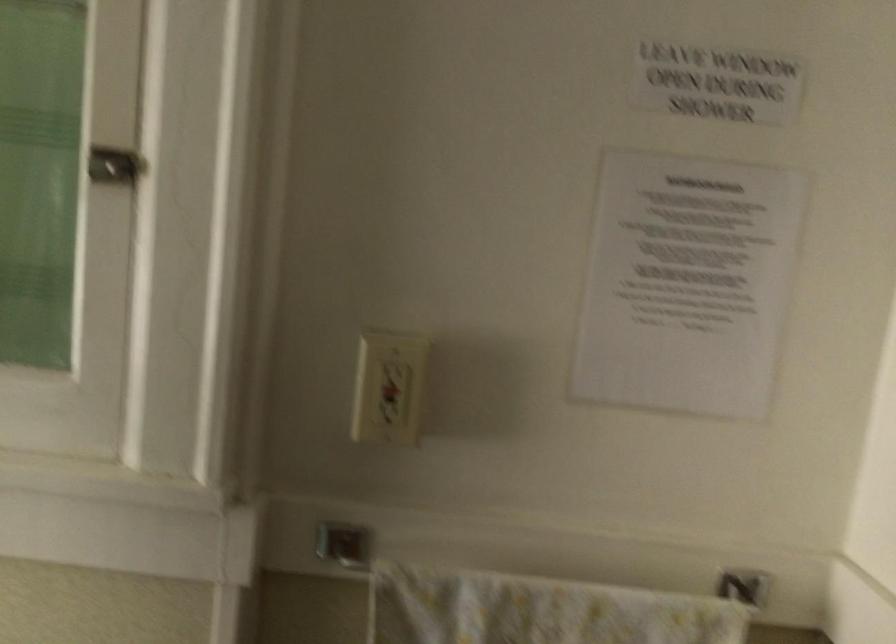
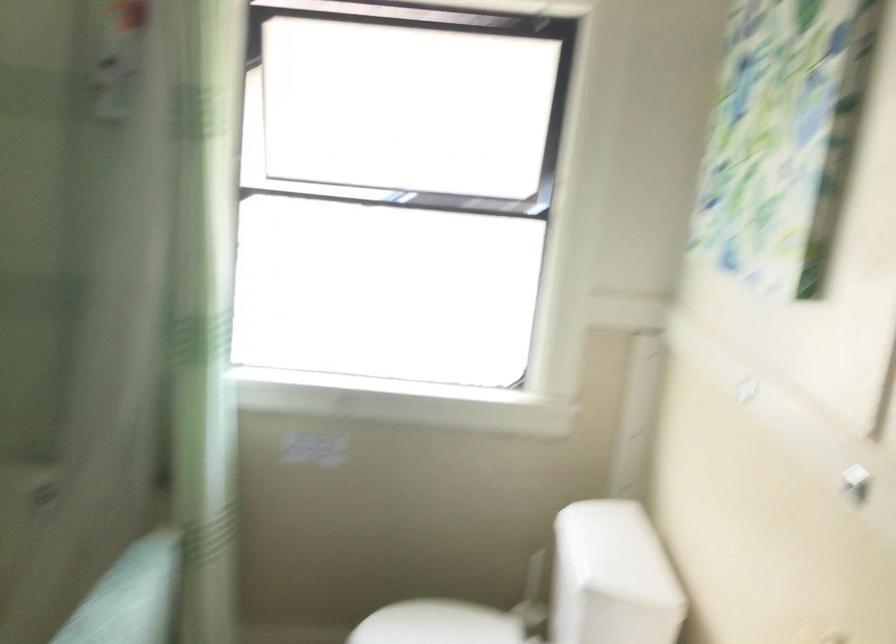
Question: How did the camera likely rotate?

Choices:
 (A) Left
 (B) Right
 (C) Up
 (D) Down

Answer: (A)